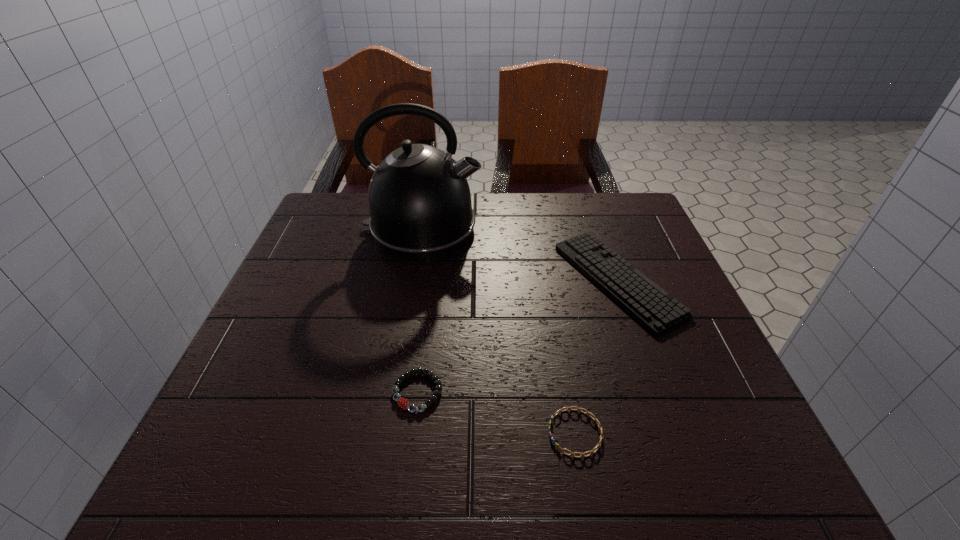
The image size is (960, 540). Find the location of `free space that satisfies the following two spatial constraints: 1. on the spout of the third shortest object; 2. on the left side of the tallest object`. free space that satisfies the following two spatial constraints: 1. on the spout of the third shortest object; 2. on the left side of the tallest object is located at coordinates (414, 280).

Where is `free space that satisfies the following two spatial constraints: 1. on the spout of the tallest object; 2. on the right side of the third shortest object`? Image resolution: width=960 pixels, height=540 pixels. free space that satisfies the following two spatial constraints: 1. on the spout of the tallest object; 2. on the right side of the third shortest object is located at coordinates (414, 280).

Where is `vacant region that satisfies the following two spatial constraints: 1. on the back side of the taller bracelet; 2. on the spout of the kettle`? vacant region that satisfies the following two spatial constraints: 1. on the back side of the taller bracelet; 2. on the spout of the kettle is located at coordinates (438, 229).